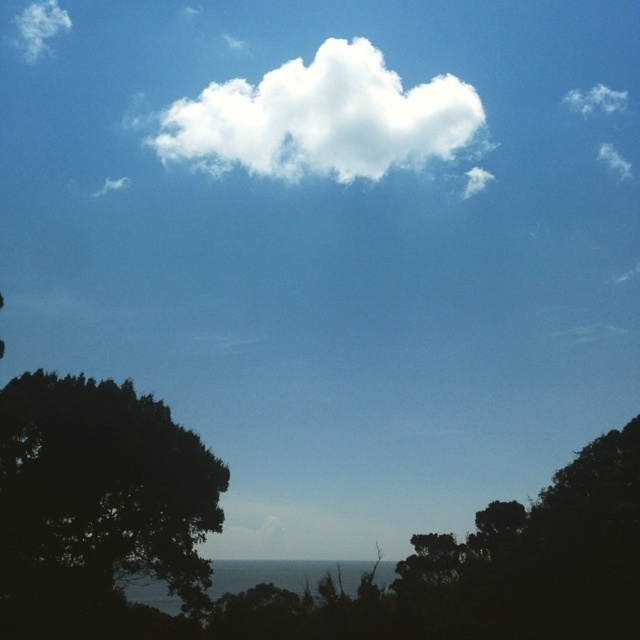
Is point (435, 145) farther from camera compared to point (48, 13)?

No.

Can you confirm if white fluffy cloud at upper center is smaller than white fluffy cloud at upper left?

Actually, white fluffy cloud at upper center might be larger than white fluffy cloud at upper left.

Between point (384, 173) and point (49, 1), which one is positioned behind?

The point (49, 1) is more distant.

I want to click on white fluffy cloud at upper center, so click(x=323, y=120).

Does dark green leafy tree at lower left have a greater width compared to white fluffy cloud at upper center?

Incorrect, dark green leafy tree at lower left's width does not surpass white fluffy cloud at upper center's.

How far apart are dark green leafy tree at lower left and white fluffy cloud at upper center?

The distance of dark green leafy tree at lower left from white fluffy cloud at upper center is 397.98 feet.

Between point (13, 534) and point (476, 186), which one is positioned behind?

The point (476, 186) is more distant.

Find the location of `dark green leafy tree at lower left`. dark green leafy tree at lower left is located at coordinates (99, 496).

Find the location of `dark green leafy tree at lower left`. dark green leafy tree at lower left is located at coordinates (99, 496).

Find the location of a particular element. dark green leafy tree at lower left is located at coordinates (99, 496).

Locate an element on the screen. Image resolution: width=640 pixels, height=640 pixels. dark green leafy tree at lower left is located at coordinates (99, 496).